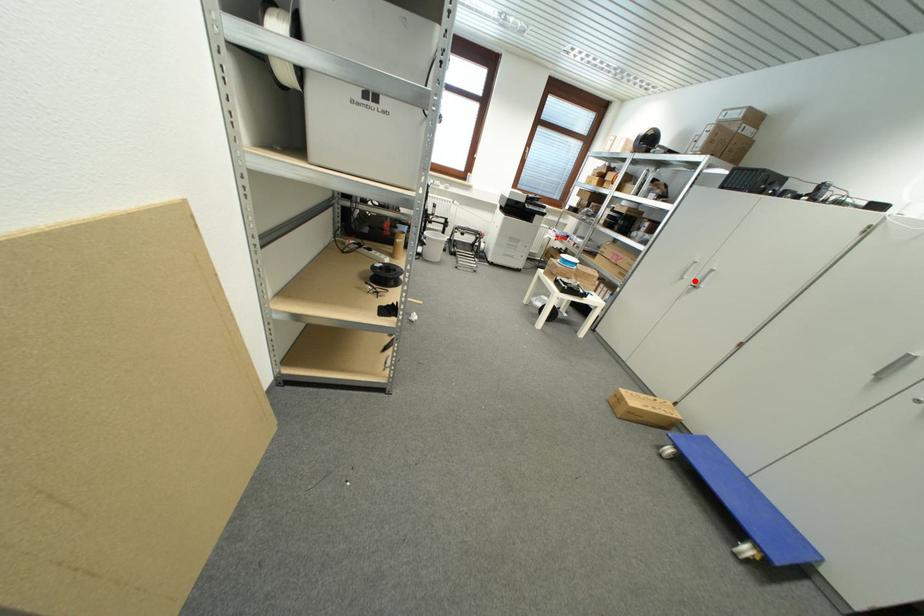
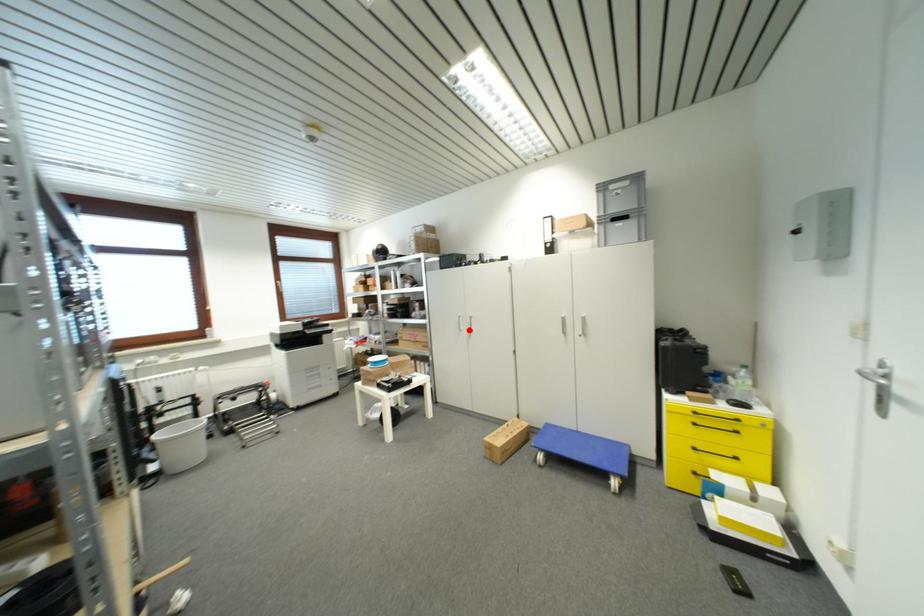
I am providing you with two images of the same scene from different viewpoints. A red point is marked on the first image and another point is marked on the second image. Is the marked point in image1 the same physical position as the marked point in image2?

Yes